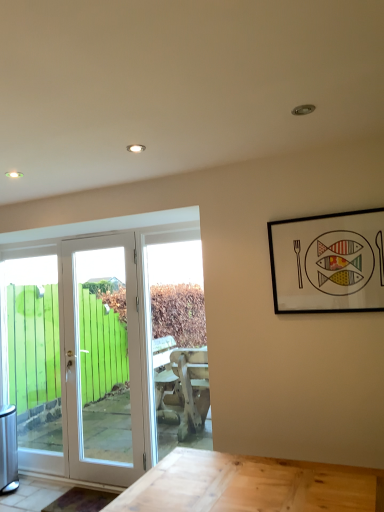
Question: Is black matte picture frame at upper right wider than white glossy door at left, the 1th door when ordered from left to right?

Choices:
 (A) no
 (B) yes

Answer: (A)

Question: Does black matte picture frame at upper right appear on the left side of white glossy door at left, the 1th door when ordered from left to right?

Choices:
 (A) no
 (B) yes

Answer: (A)

Question: From a real-world perspective, is black matte picture frame at upper right physically above white glossy door at left, the 1th door when ordered from left to right?

Choices:
 (A) yes
 (B) no

Answer: (A)

Question: Can you confirm if black matte picture frame at upper right is positioned to the right of white glossy door at left, positioned as the second door in right-to-left order?

Choices:
 (A) no
 (B) yes

Answer: (B)

Question: Can you confirm if black matte picture frame at upper right is taller than white glossy door at left, the 1th door when ordered from left to right?

Choices:
 (A) no
 (B) yes

Answer: (A)

Question: Does black matte picture frame at upper right have a smaller size compared to white glossy door at left, positioned as the second door in right-to-left order?

Choices:
 (A) no
 (B) yes

Answer: (B)

Question: Does white glossy door at left, which appears as the first door when viewed from the right, have a larger size compared to transparent glass door at left?

Choices:
 (A) no
 (B) yes

Answer: (B)

Question: Does white glossy door at left, the second door in the left-to-right sequence, appear on the left side of transparent glass door at left?

Choices:
 (A) yes
 (B) no

Answer: (B)

Question: Is the position of white glossy door at left, the second door in the left-to-right sequence, less distant than that of transparent glass door at left?

Choices:
 (A) no
 (B) yes

Answer: (B)

Question: From a real-world perspective, is white glossy door at left, the second door in the left-to-right sequence, located higher than transparent glass door at left?

Choices:
 (A) no
 (B) yes

Answer: (B)

Question: Is white glossy door at left, which appears as the first door when viewed from the right, further to the viewer compared to transparent glass door at left?

Choices:
 (A) no
 (B) yes

Answer: (A)

Question: Is transparent glass door at left located within white glossy door at left, which appears as the first door when viewed from the right?

Choices:
 (A) yes
 (B) no

Answer: (B)

Question: Is transparent glass door at left in front of white glossy door at left, which appears as the first door when viewed from the right?

Choices:
 (A) yes
 (B) no

Answer: (B)